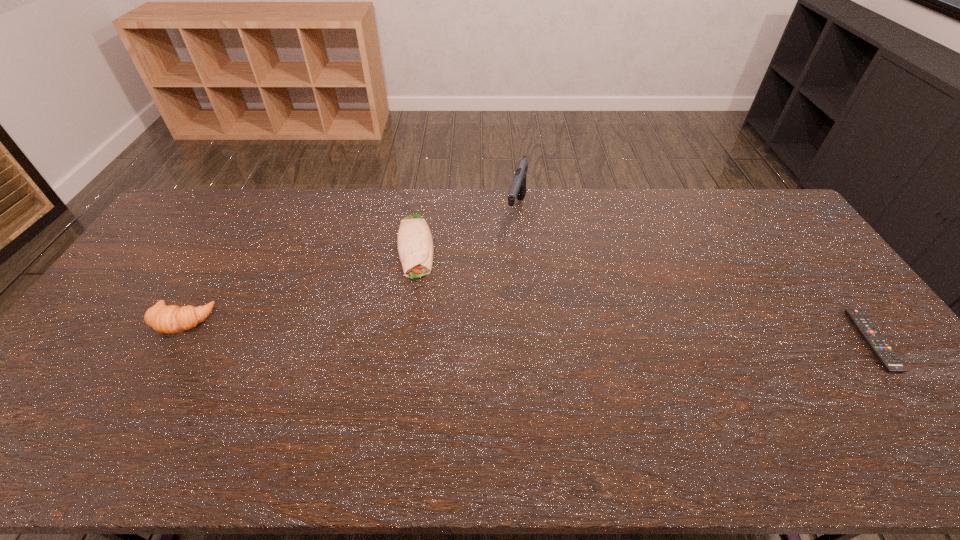
I want to click on free space on the desktop that is between the crescent roll and the rightmost object and is positioned at the muzzle of the gun, so click(608, 334).

Identify the location of vacant space on the desktop that is between the third shortest object and the remote control and is positioned at the bitten end of the third object from right to left. 423,328.